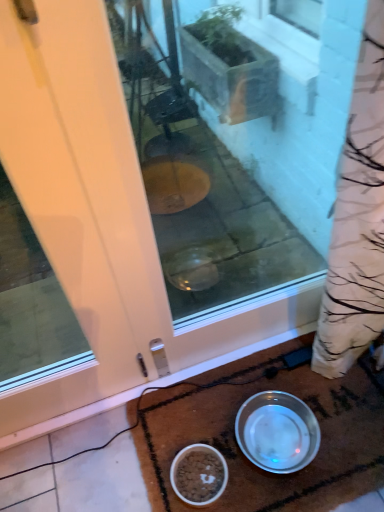
Image resolution: width=384 pixels, height=512 pixels. I want to click on free space above brown textured doormat at lower center (from a real-world perspective), so click(262, 432).